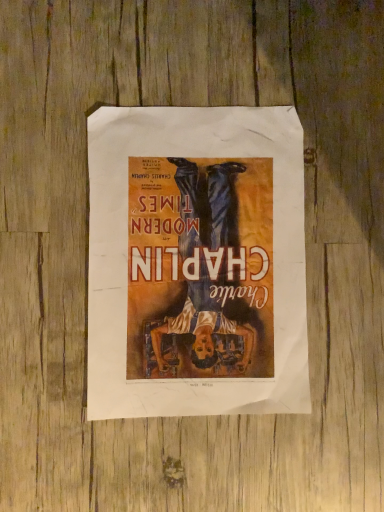
The height and width of the screenshot is (512, 384). Find the location of `vacant area on top of matte paper poster at center (from a real-world perspective)`. vacant area on top of matte paper poster at center (from a real-world perspective) is located at coordinates (194, 260).